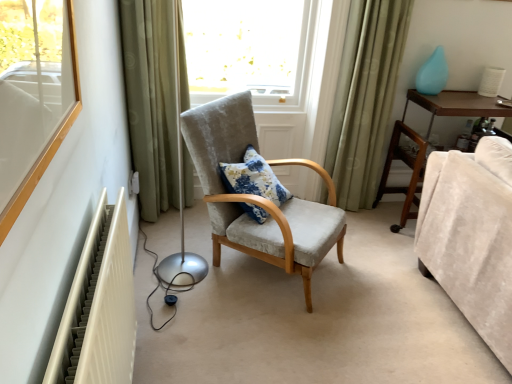
What do you see at coordinates (151, 101) in the screenshot? This screenshot has height=384, width=512. I see `green fabric curtain at left, the first curtain viewed from the left` at bounding box center [151, 101].

This screenshot has height=384, width=512. I want to click on velvet beige couch at lower right, so pos(472,236).

The height and width of the screenshot is (384, 512). Describe the element at coordinates (472, 236) in the screenshot. I see `velvet beige couch at lower right` at that location.

Where is `brown wooden dresser at right`? This screenshot has width=512, height=384. brown wooden dresser at right is located at coordinates (428, 137).

Where is `floral fabric pillow at center`? floral fabric pillow at center is located at coordinates (253, 178).

This screenshot has width=512, height=384. What do you see at coordinates (365, 98) in the screenshot? I see `green fabric curtain at right, the first curtain viewed from the right` at bounding box center [365, 98].

Where is `white plastic electric outlet at lower left`? The height and width of the screenshot is (384, 512). white plastic electric outlet at lower left is located at coordinates (134, 183).

Which object is further away from the camera taking this photo, green fabric curtain at left, the second curtain positioned from the right, or green fabric curtain at right, placed as the second curtain when sorted from left to right?

green fabric curtain at right, placed as the second curtain when sorted from left to right, is behind.

Does green fabric curtain at left, the first curtain viewed from the left, contain green fabric curtain at right, the first curtain viewed from the right?

No.

Which is behind, point (158, 61) or point (346, 74)?

The point (346, 74) is more distant.

Which object is thinner, green fabric curtain at left, the first curtain viewed from the left, or green fabric curtain at right, the first curtain viewed from the right?

With smaller width is green fabric curtain at right, the first curtain viewed from the right.

In the image, is floral fabric pillow at center positioned in front of or behind textured fabric armchair at center?

Clearly, floral fabric pillow at center is behind textured fabric armchair at center.

Where is `pillow above the textured fabric armchair at center (from the image's perspective)`? pillow above the textured fabric armchair at center (from the image's perspective) is located at coordinates (253, 178).

Which object is positioned more to the left, floral fabric pillow at center or textured fabric armchair at center?

floral fabric pillow at center.

Can you see floral fabric pillow at center touching textured fabric armchair at center?

No, floral fabric pillow at center is not next to textured fabric armchair at center.

From a real-world perspective, relative to green fabric curtain at left, the first curtain viewed from the left, is white plastic electric outlet at lower left vertically above or below?

In terms of real-world spatial position, white plastic electric outlet at lower left is below green fabric curtain at left, the first curtain viewed from the left.

Is white plastic electric outlet at lower left turned away from green fabric curtain at left, the first curtain viewed from the left?

white plastic electric outlet at lower left is not turned away from green fabric curtain at left, the first curtain viewed from the left.

From a real-world perspective, which curtain is the 1st one above the white plastic electric outlet at lower left? Please provide its 2D coordinates.

[(151, 101)]

Based on the photo, can you tell me how much white plastic electric outlet at lower left and green fabric curtain at left, the second curtain positioned from the right, differ in facing direction?

The facing directions of white plastic electric outlet at lower left and green fabric curtain at left, the second curtain positioned from the right, are 93.8 degrees apart.

Does brown wooden dresser at right contain white plastic electric outlet at lower left?

Actually, white plastic electric outlet at lower left is outside brown wooden dresser at right.

Between brown wooden dresser at right and white plastic electric outlet at lower left, which one has smaller width?

white plastic electric outlet at lower left.

How different are the orientations of brown wooden dresser at right and white plastic electric outlet at lower left in degrees?

93.3 degrees.

How distant is brown wooden dresser at right from white plastic electric outlet at lower left?

The distance of brown wooden dresser at right from white plastic electric outlet at lower left is 5.96 feet.

Between velvet beige couch at lower right and green fabric curtain at right, the first curtain viewed from the right, which one has smaller size?

With smaller size is green fabric curtain at right, the first curtain viewed from the right.

From the image's perspective, which is above, velvet beige couch at lower right or green fabric curtain at right, the first curtain viewed from the right?

green fabric curtain at right, the first curtain viewed from the right, from the image's perspective.

Considering the sizes of velvet beige couch at lower right and green fabric curtain at right, placed as the second curtain when sorted from left to right, in the image, is velvet beige couch at lower right wider or thinner than green fabric curtain at right, placed as the second curtain when sorted from left to right,?

Considering their sizes, velvet beige couch at lower right looks broader than green fabric curtain at right, placed as the second curtain when sorted from left to right.

Is point (421, 227) closer to viewer compared to point (369, 173)?

Yes, point (421, 227) is closer to viewer.

Between point (375, 200) and point (482, 330), which one is positioned behind?

Point (375, 200)

From a real-world perspective, does brown wooden dresser at right sit lower than velvet beige couch at lower right?

Correct, in the physical world, brown wooden dresser at right is lower than velvet beige couch at lower right.

From the picture: Between brown wooden dresser at right and velvet beige couch at lower right, which one is positioned in front?

velvet beige couch at lower right is in front.

Between brown wooden dresser at right and velvet beige couch at lower right, which one has smaller size?

Answer: brown wooden dresser at right.

Is green fabric curtain at left, the second curtain positioned from the right, at the left side of velvet beige couch at lower right?

Correct, you'll find green fabric curtain at left, the second curtain positioned from the right, to the left of velvet beige couch at lower right.

How different are the orientations of green fabric curtain at left, the second curtain positioned from the right, and velvet beige couch at lower right in degrees?

The facing directions of green fabric curtain at left, the second curtain positioned from the right, and velvet beige couch at lower right are 91.3 degrees apart.

Does point (152, 110) come farther from viewer compared to point (489, 326)?

That is True.

From the image's perspective, is green fabric curtain at left, the first curtain viewed from the left, above or below velvet beige couch at lower right?

green fabric curtain at left, the first curtain viewed from the left, is situated higher than velvet beige couch at lower right in the image.

Where is `curtain located above the green fabric curtain at left, the second curtain positioned from the right (from a real-world perspective)`? Image resolution: width=512 pixels, height=384 pixels. curtain located above the green fabric curtain at left, the second curtain positioned from the right (from a real-world perspective) is located at coordinates (365, 98).

This screenshot has height=384, width=512. I want to click on pillow lying behind the textured fabric armchair at center, so click(253, 178).

Considering their positions, is green fabric curtain at left, the first curtain viewed from the left, positioned closer to textured fabric armchair at center than floral fabric pillow at center?

floral fabric pillow at center is positioned closer to the anchor textured fabric armchair at center.

Estimate the real-world distances between objects in this image. Which object is further from brown wooden dresser at right, teal glossy vase at upper right or floral fabric pillow at center?

Among the two, floral fabric pillow at center is located further to brown wooden dresser at right.

Considering their positions, is velvet beige couch at lower right positioned further to floral fabric pillow at center than green fabric curtain at left, the first curtain viewed from the left?

velvet beige couch at lower right lies further to floral fabric pillow at center than the other object.

Looking at the image, which one is located further to white plastic electric outlet at lower left, floral fabric pillow at center or velvet beige couch at lower right?

Based on the image, velvet beige couch at lower right appears to be further to white plastic electric outlet at lower left.

Considering their positions, is green fabric curtain at left, the second curtain positioned from the right, positioned closer to white plastic electric outlet at lower left than velvet beige couch at lower right?

Based on the image, green fabric curtain at left, the second curtain positioned from the right, appears to be nearer to white plastic electric outlet at lower left.

Considering their positions, is textured fabric armchair at center positioned further to green fabric curtain at right, placed as the second curtain when sorted from left to right, than green fabric curtain at left, the second curtain positioned from the right?

Based on the image, green fabric curtain at left, the second curtain positioned from the right, appears to be further to green fabric curtain at right, placed as the second curtain when sorted from left to right.

Based on their spatial positions, is textured fabric armchair at center or velvet beige couch at lower right closer to teal glossy vase at upper right?

velvet beige couch at lower right.

Based on their spatial positions, is green fabric curtain at right, the first curtain viewed from the right, or textured fabric armchair at center closer to teal glossy vase at upper right?

green fabric curtain at right, the first curtain viewed from the right, is closer to teal glossy vase at upper right.

Image resolution: width=512 pixels, height=384 pixels. What are the coordinates of `chair between green fabric curtain at left, the first curtain viewed from the left, and velvet beige couch at lower right from left to right` in the screenshot? It's located at (258, 197).

The image size is (512, 384). I want to click on teal between white plastic electric outlet at lower left and velvet beige couch at lower right, so click(433, 74).

At what (x,y) coordinates should I click in order to perform the action: click on chair between floral fabric pillow at center and brown wooden dresser at right from left to right. Please return your answer as a coordinate pair (x, y). Image resolution: width=512 pixels, height=384 pixels. Looking at the image, I should click on (258, 197).

In order to click on curtain situated between textured fabric armchair at center and teal glossy vase at upper right from left to right in this screenshot , I will do `click(365, 98)`.